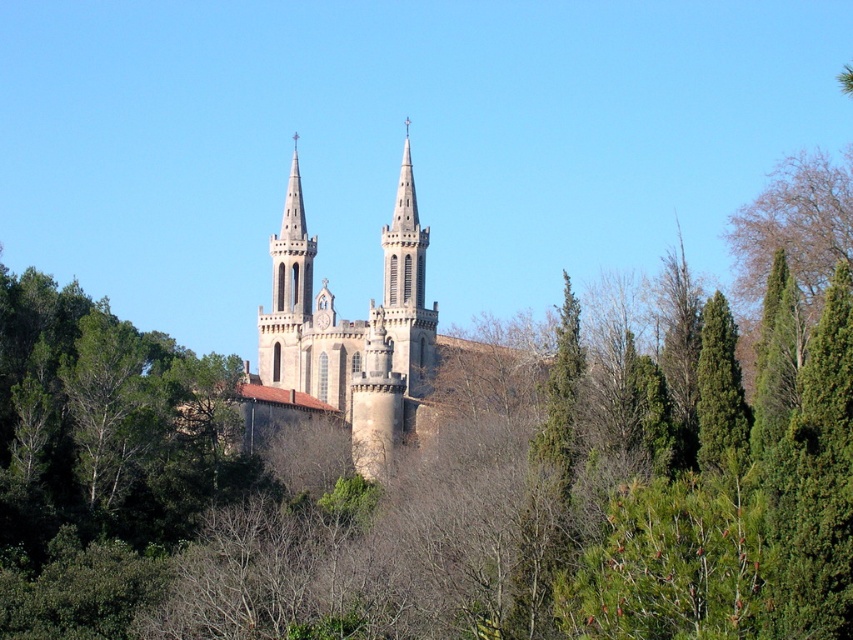
Who is taller, stone church at center or green textured pine tree at center-right?

stone church at center

From the picture: Who is more distant from viewer, (296, 378) or (566, 448)?

The point (296, 378) is more distant.

Where is `stone church at center`? This screenshot has width=853, height=640. stone church at center is located at coordinates (352, 333).

Is point (726, 432) farther from viewer compared to point (570, 292)?

No, (726, 432) is closer to viewer.

You are a GUI agent. You are given a task and a screenshot of the screen. Output one action in this format:
    pyautogui.click(x=<x>, y=<y>)
    Task: Click on the green coniferous tree at right
    
    Given the screenshot: What is the action you would take?
    (x=720, y=394)

Does point (289, 292) come in front of point (726, 348)?

No, it is not.

Is point (271, 387) positioned behind point (729, 472)?

Yes, it is.

This screenshot has width=853, height=640. In order to click on stone church at center in this screenshot , I will do `click(352, 333)`.